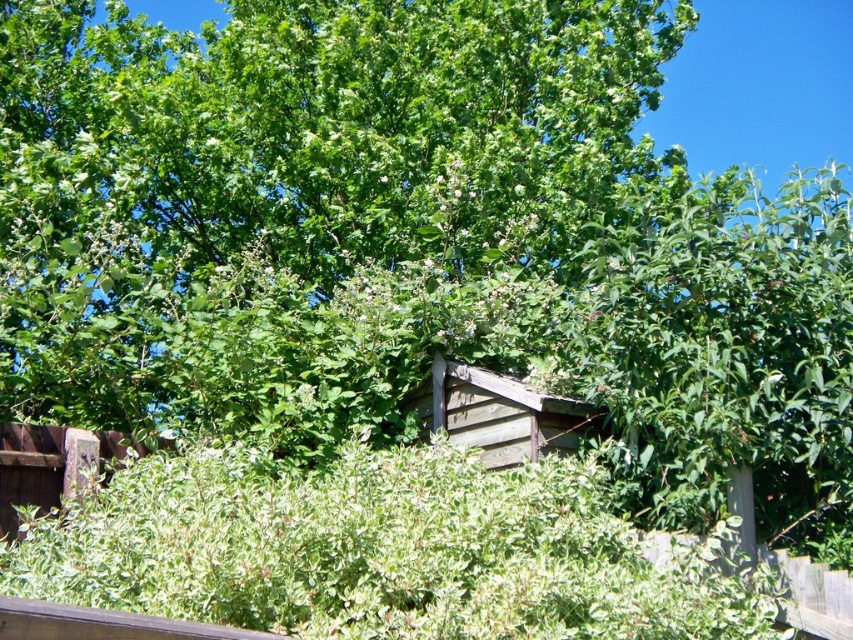
Question: Is green leafy tree at center wider than weathered wood hut at center?

Choices:
 (A) no
 (B) yes

Answer: (A)

Question: Which point is closer to the camera?

Choices:
 (A) weathered wood hut at center
 (B) green leafy tree at center

Answer: (A)

Question: Among these points, which one is nearest to the camera?

Choices:
 (A) (397, 289)
 (B) (486, 420)

Answer: (B)

Question: Can you confirm if green leafy tree at center is bigger than weathered wood hut at center?

Choices:
 (A) yes
 (B) no

Answer: (B)

Question: Can you confirm if green leafy tree at center is bigger than weathered wood hut at center?

Choices:
 (A) yes
 (B) no

Answer: (B)

Question: Which point is farther from the camera taking this photo?

Choices:
 (A) (442, 410)
 (B) (64, 54)

Answer: (B)